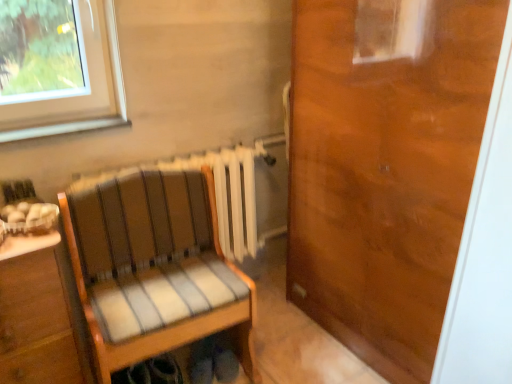
Question: Considering the relative positions of striped fabric chair at center and wooden door at right in the image provided, is striped fabric chair at center to the left of wooden door at right from the viewer's perspective?

Choices:
 (A) yes
 (B) no

Answer: (A)

Question: From a real-world perspective, is striped fabric chair at center below wooden door at right?

Choices:
 (A) yes
 (B) no

Answer: (A)

Question: Does striped fabric chair at center lie in front of wooden door at right?

Choices:
 (A) no
 (B) yes

Answer: (A)

Question: Does striped fabric chair at center have a smaller size compared to wooden door at right?

Choices:
 (A) no
 (B) yes

Answer: (B)

Question: From a real-world perspective, does striped fabric chair at center stand above wooden door at right?

Choices:
 (A) yes
 (B) no

Answer: (B)

Question: Can you confirm if striped fabric chair at center is wider than wooden door at right?

Choices:
 (A) yes
 (B) no

Answer: (A)

Question: From the image's perspective, is wooden door at right on top of striped fabric chair at center?

Choices:
 (A) no
 (B) yes

Answer: (B)

Question: From a real-world perspective, is wooden door at right positioned over striped fabric chair at center based on gravity?

Choices:
 (A) no
 (B) yes

Answer: (B)

Question: Is wooden door at right facing away from striped fabric chair at center?

Choices:
 (A) yes
 (B) no

Answer: (B)

Question: Does wooden door at right have a greater width compared to striped fabric chair at center?

Choices:
 (A) no
 (B) yes

Answer: (A)

Question: Are wooden door at right and striped fabric chair at center located far from each other?

Choices:
 (A) yes
 (B) no

Answer: (B)

Question: Is wooden door at right oriented towards striped fabric chair at center?

Choices:
 (A) no
 (B) yes

Answer: (B)

Question: Looking at the image, does striped fabric chair at center seem bigger or smaller compared to wooden door at right?

Choices:
 (A) small
 (B) big

Answer: (A)